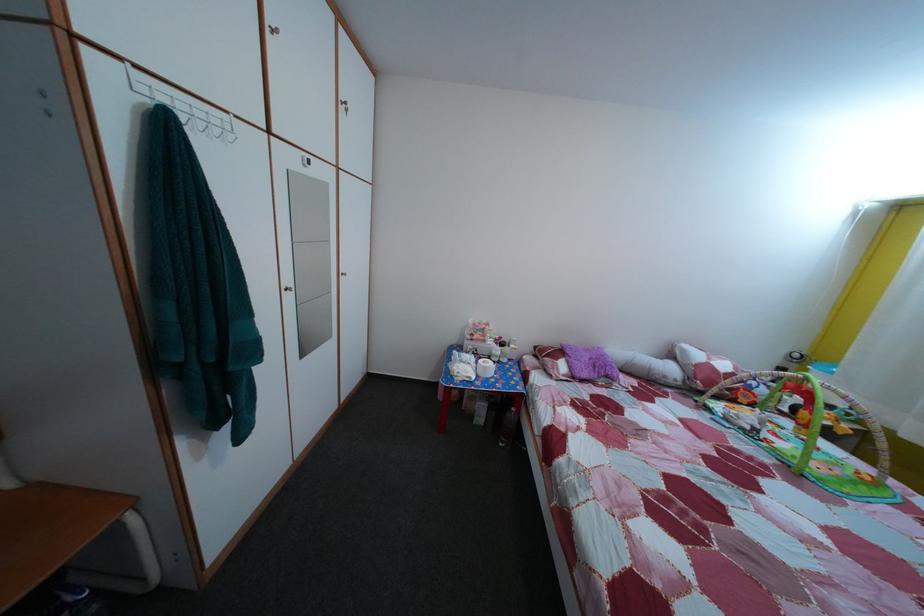
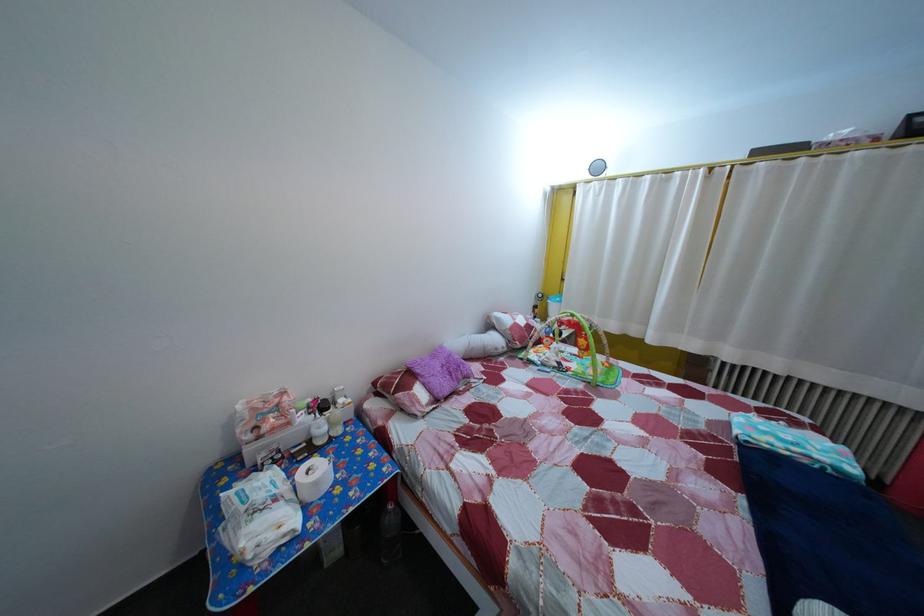
Where in the second image is the point corresponding to pixel 494 376 from the first image?

(325, 491)